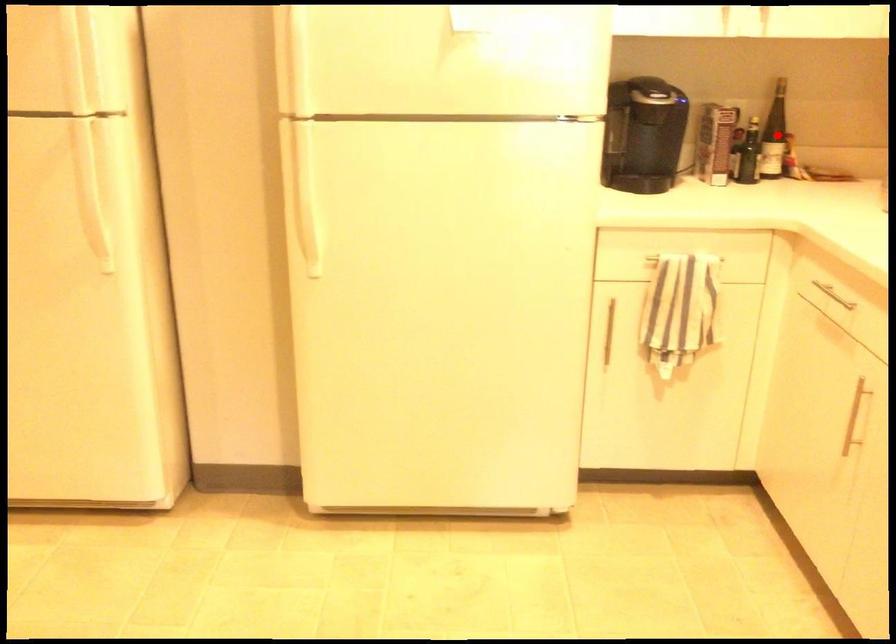
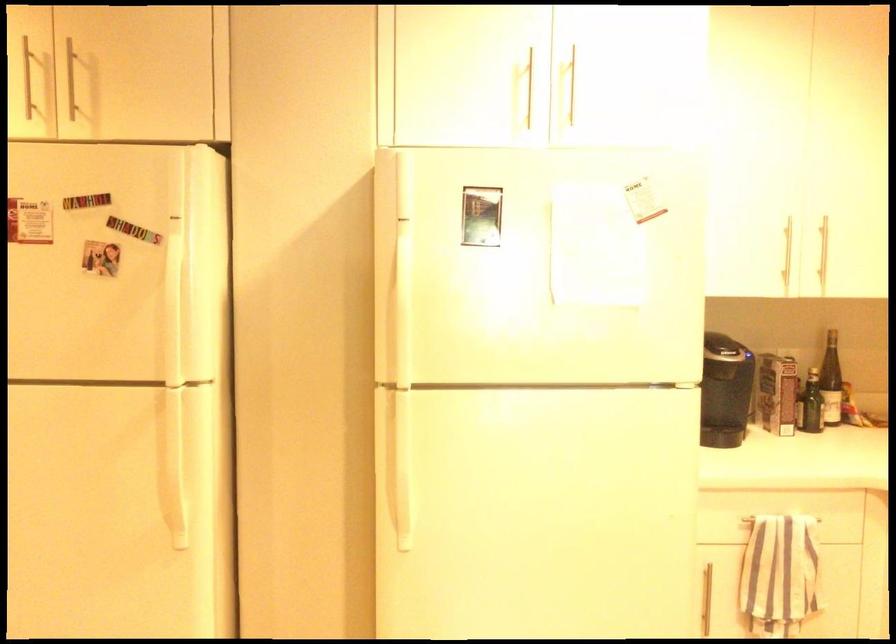
Where in the second image is the point corresponding to the highlighted location from the first image?

(831, 381)